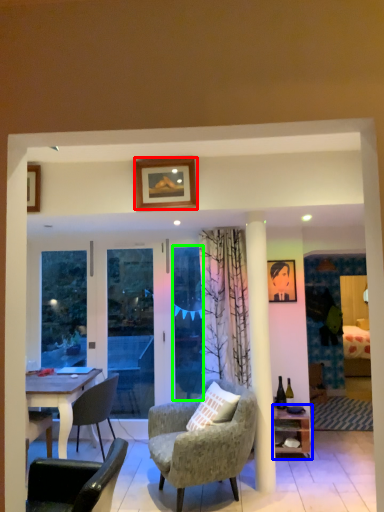
Question: Based on their relative distances, which object is farther from picture frame (highlighted by a red box)? Choose from shelf (highlighted by a blue box) and glass door (highlighted by a green box).

Choices:
 (A) shelf
 (B) glass door

Answer: (A)